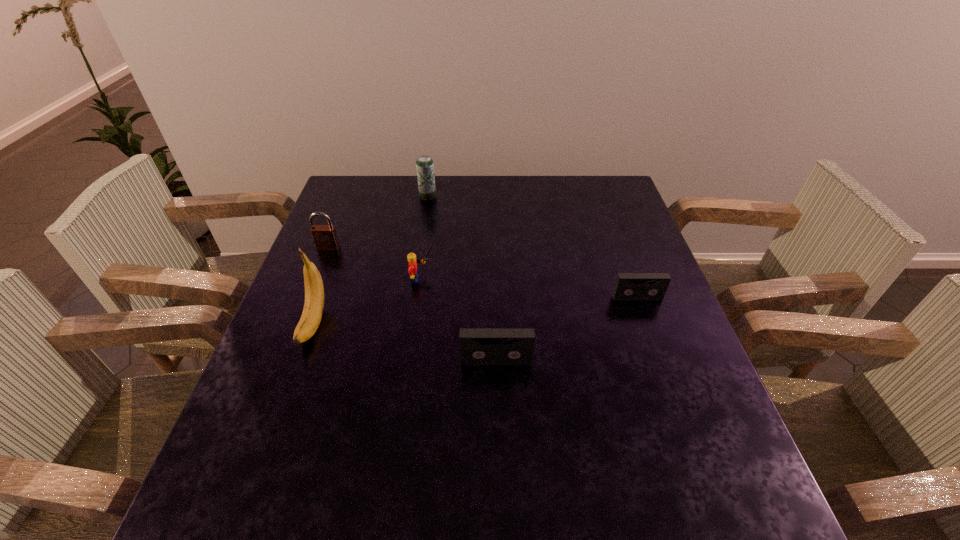
What are the coordinates of `unoccupied position between the nearer videotape and the beer can` in the screenshot? It's located at (462, 279).

At what (x,y) coordinates should I click in order to perform the action: click on unoccupied position between the Lego and the nearer videotape. Please return your answer as a coordinate pair (x, y). This screenshot has height=540, width=960. Looking at the image, I should click on (460, 320).

The width and height of the screenshot is (960, 540). I want to click on free space between the shortest object and the banana, so click(x=475, y=310).

Find the location of a particular element. free area in between the Lego and the tallest object is located at coordinates (369, 301).

Where is `object that is the fourth closest one to the padlock`? The width and height of the screenshot is (960, 540). object that is the fourth closest one to the padlock is located at coordinates coord(477,346).

Where is `object that stands as the fifth closest to the farther videotape`? This screenshot has height=540, width=960. object that stands as the fifth closest to the farther videotape is located at coordinates tap(325, 238).